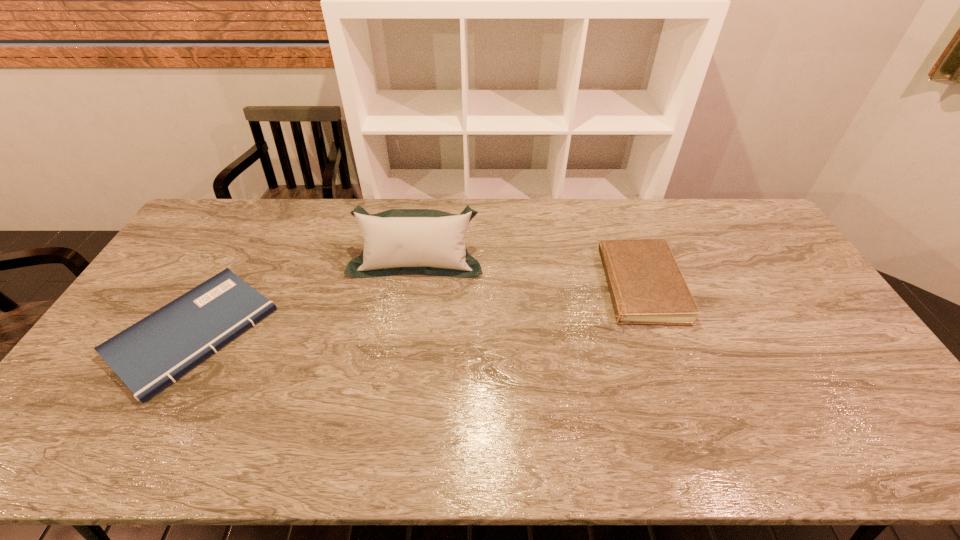
Locate an element on the screen. The height and width of the screenshot is (540, 960). vacant space located on the right of the shortest object is located at coordinates (357, 332).

You are a GUI agent. You are given a task and a screenshot of the screen. Output one action in this format:
    pyautogui.click(x=<x>, y=<y>)
    Task: Click on the object located in the left edge section of the desktop
    The width and height of the screenshot is (960, 540).
    Given the screenshot: What is the action you would take?
    pyautogui.click(x=148, y=356)

In order to click on vacant space at the far edge in this screenshot , I will do `click(319, 235)`.

Where is `vacant region at the near edge`? The image size is (960, 540). vacant region at the near edge is located at coordinates (718, 433).

At what (x,y) coordinates should I click in order to perform the action: click on free space at the right edge. Please return your answer as a coordinate pair (x, y). The image size is (960, 540). Looking at the image, I should click on (784, 285).

This screenshot has width=960, height=540. What are the coordinates of `blank space at the far left corner of the desktop` in the screenshot? It's located at (220, 217).

You are a GUI agent. You are given a task and a screenshot of the screen. Output one action in this format:
    pyautogui.click(x=<x>, y=<y>)
    Task: Click on the free space between the tallest object and the second tallest object
    Image resolution: width=960 pixels, height=540 pixels.
    Given the screenshot: What is the action you would take?
    pyautogui.click(x=524, y=273)

Where is `vacant space that's between the second object from right to left and the taller paperback book`? This screenshot has width=960, height=540. vacant space that's between the second object from right to left and the taller paperback book is located at coordinates (524, 273).

This screenshot has height=540, width=960. Find the location of `free area in between the taller paperback book and the shortest object`. free area in between the taller paperback book and the shortest object is located at coordinates (413, 309).

Locate an element on the screen. This screenshot has height=540, width=960. vacant area that lies between the tallest object and the shortest object is located at coordinates 305,296.